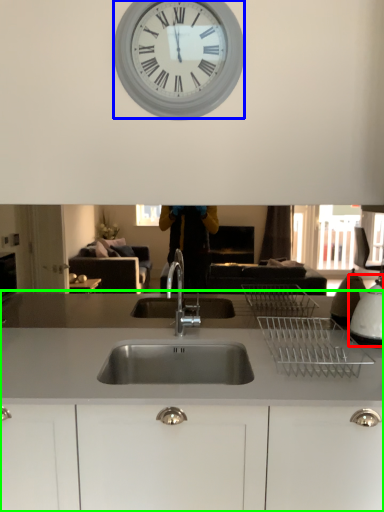
Question: Which object is the closest to the appliance (highlighted by a red box)? Choose among these: wall clock (highlighted by a blue box) or countertop (highlighted by a green box).

Choices:
 (A) wall clock
 (B) countertop

Answer: (B)